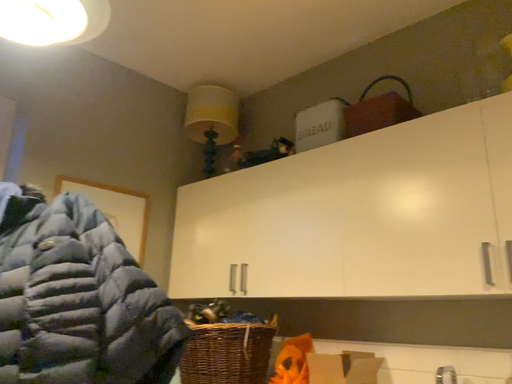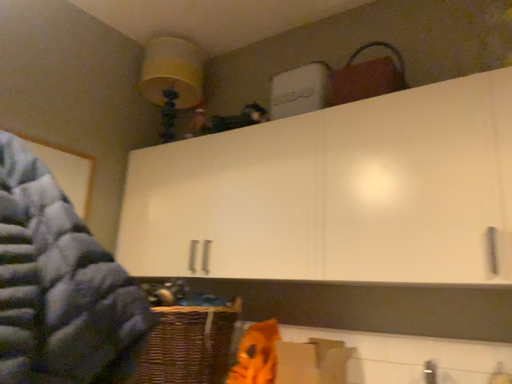
Question: Which way did the camera rotate in the video?

Choices:
 (A) rotated left
 (B) rotated right

Answer: (B)